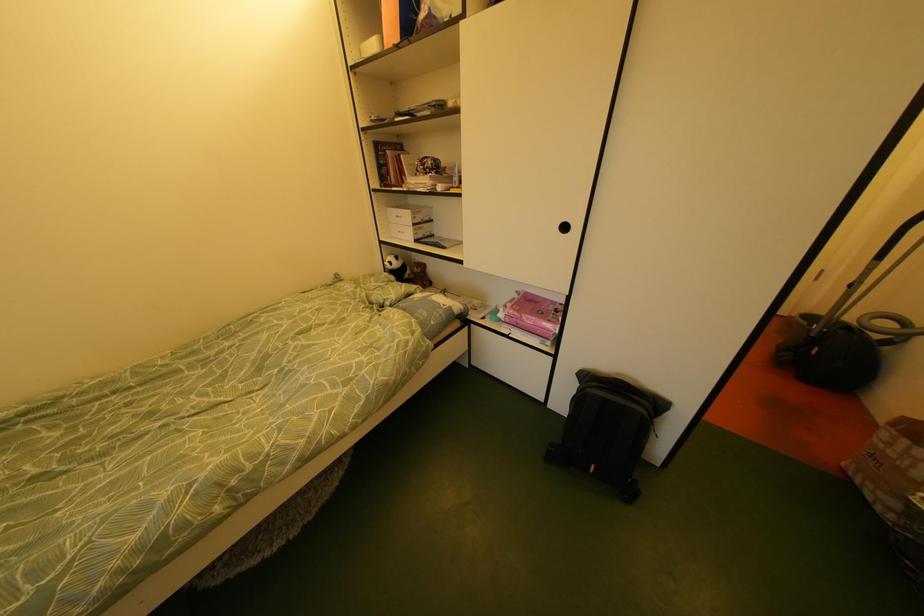
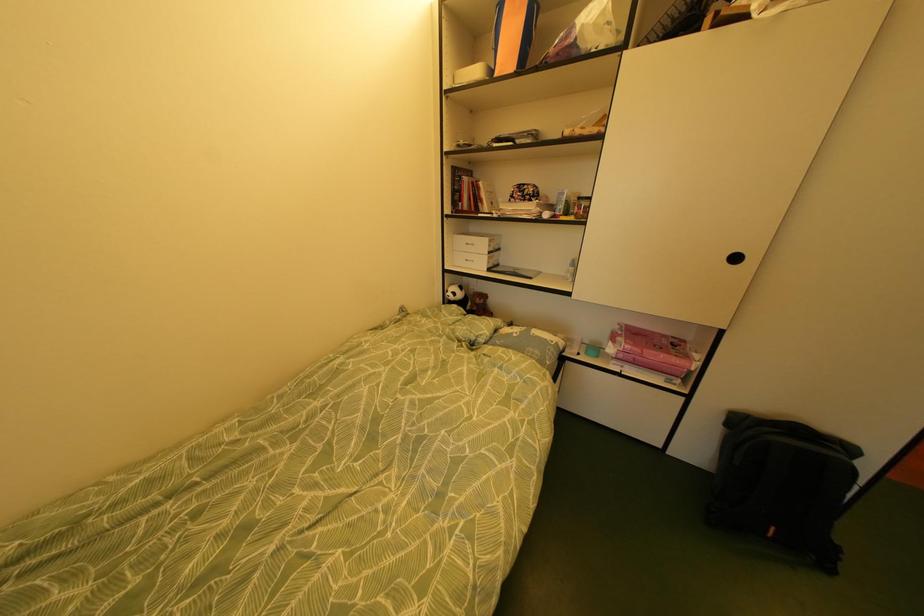
Question: The first image is from the beginning of the video and the second image is from the end. How did the camera likely rotate when shooting the video?

Choices:
 (A) Left
 (B) Right
 (C) Up
 (D) Down

Answer: (B)